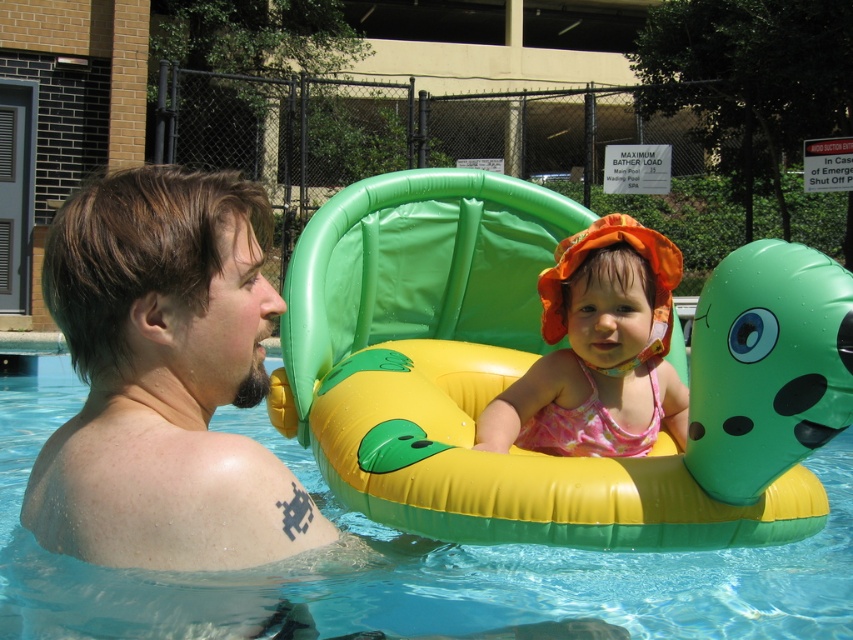
You are a photographer at the poolside. You need to capture a photo where both the smooth skin man at left and the pink fabric swimsuit at center are clearly visible. Based on their sizes, which subject should you focus on first to ensure both are in frame?

The smooth skin man at left is smaller than the pink fabric swimsuit at center. To ensure both are in frame, focus on the pink fabric swimsuit at center first as it is larger and adjust the camera angle to include the smaller smooth skin man at left.

From the picture: You are standing at the edge of the swimming pool and want to reach the yellow rubber float at center. According to the coordinates provided, in which direction should you swim to reach it?

The yellow rubber float at center is located at coordinates point (537, 358). Since the coordinate system starts from the bottom left corner of the image, you should swim towards the upper right direction to reach it.